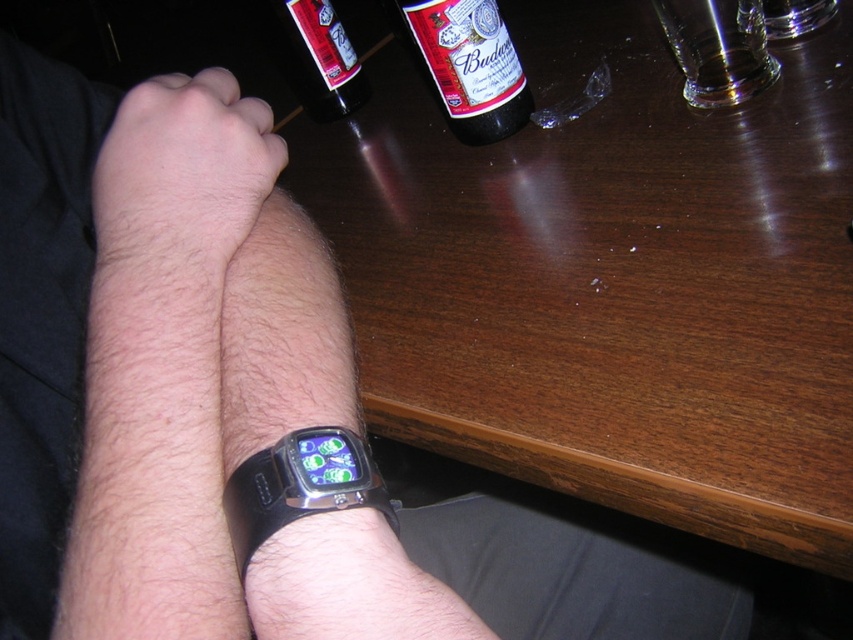
You are a delivery robot that needs to place a small package on the table without disturbing the existing items. The table is represented in a coordinate system where the bottom left corner is the origin point. The bottle at upper center is located at coordinates 0.103, 0.551. Can you place the package at coordinates 0.103, 0.551?

The bottle at upper center is already located at coordinates (469, 65), so placing the package there would displace the bottle. Choose an alternative location.

You are trying to place a small sticker on the table between the two points, point (x=161, y=90) and point (x=308, y=438). Which point is closer to you so you can start placing the sticker from there?

Point (x=161, y=90) is closer to the viewer than point (x=308, y=438), so you can start placing the sticker from there.